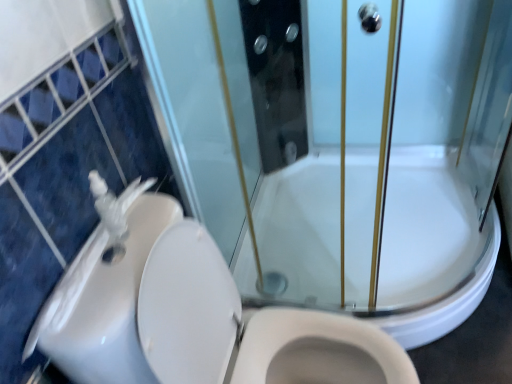
Question: Considering the positions of white glossy bath at center and white glossy sink at left in the image, is white glossy bath at center taller or shorter than white glossy sink at left?

Choices:
 (A) tall
 (B) short

Answer: (A)

Question: In the image, is white glossy bath at center on the left side or the right side of white glossy sink at left?

Choices:
 (A) left
 (B) right

Answer: (B)

Question: Based on their relative distances, which object is farther from the white glossy sink at left?

Choices:
 (A) white glossy bath at center
 (B) white glossy toilet at lower left

Answer: (A)

Question: Which object is the farthest from the white glossy toilet at lower left?

Choices:
 (A) white glossy bath at center
 (B) white glossy sink at left

Answer: (A)